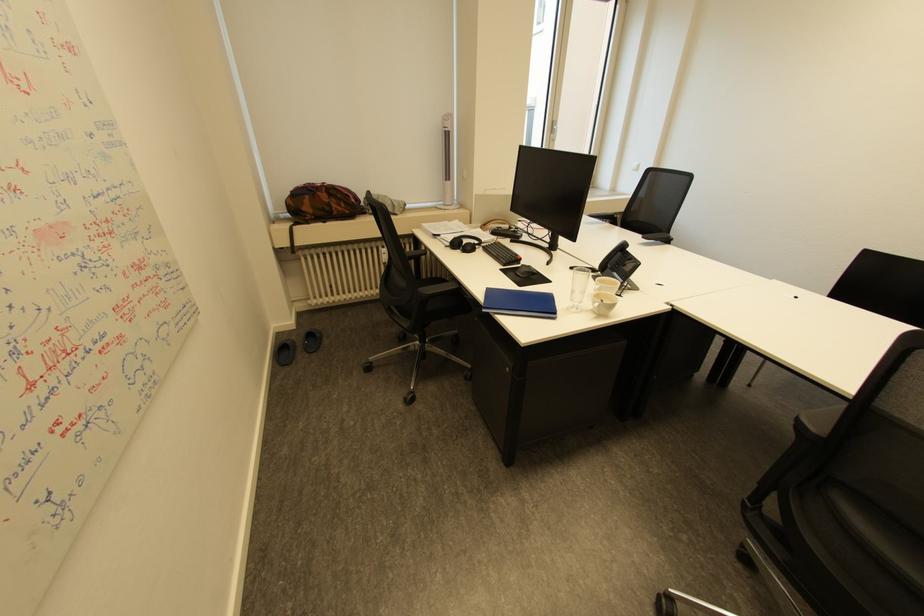
The location [518,302] corresponds to which object?

It refers to a blue folder.